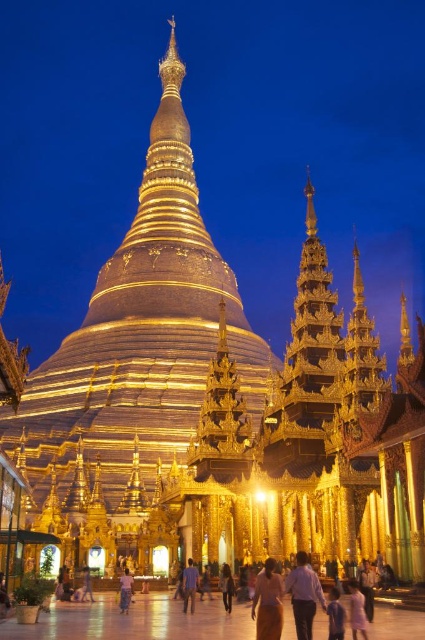
You are a photographer standing in the temple complex and want to take a photo of the golden pagoda. You notice the pink fabric dress at lower center and the purple cotton shirt at center in the foreground. Which clothing item will appear closer to the camera in your photo?

The pink fabric dress at lower center will appear closer to the camera because it is in front of the purple cotton shirt at center.